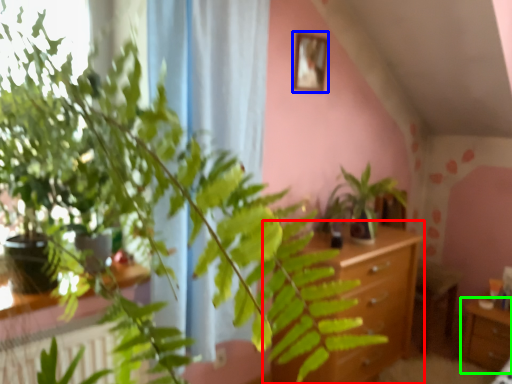
Question: Considering the real-world distances, which object is closest to vanity (highlighted by a red box)? picture frame (highlighted by a blue box) or table (highlighted by a green box).

Choices:
 (A) picture frame
 (B) table

Answer: (B)